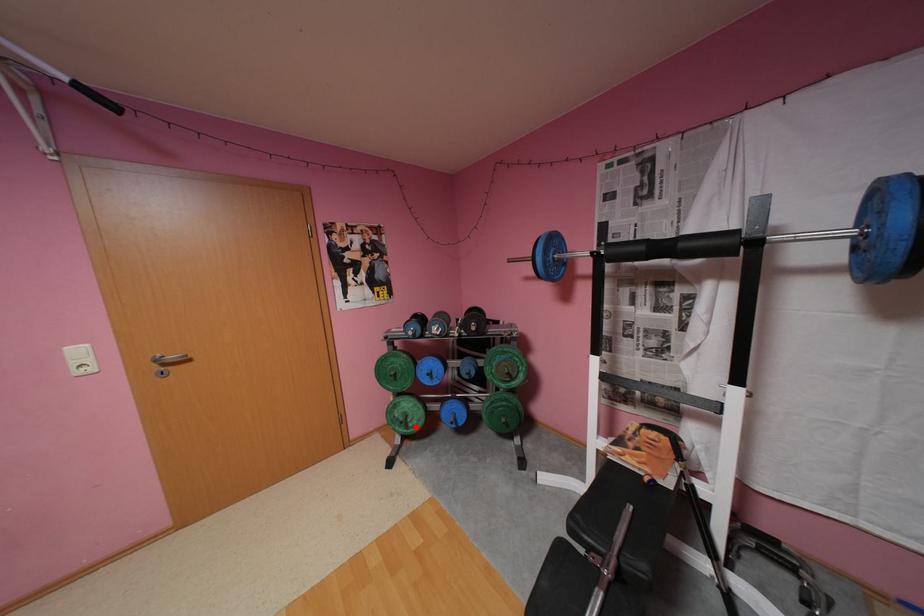
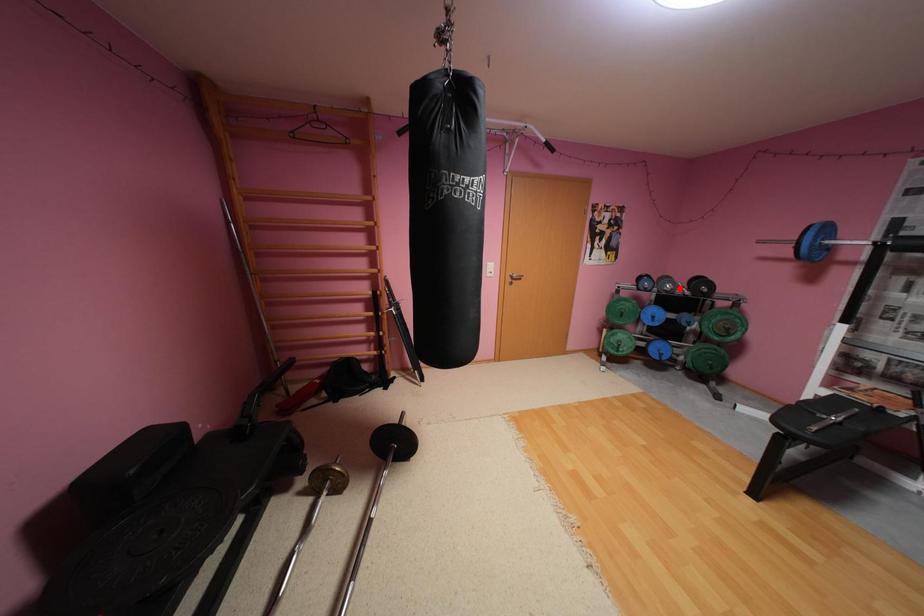
Consider the image. I am providing you with two images of the same scene from different viewpoints. A red point is marked on the first image and another point is marked on the second image. Are the points marked in image1 and image2 representing the same 3D position?

No